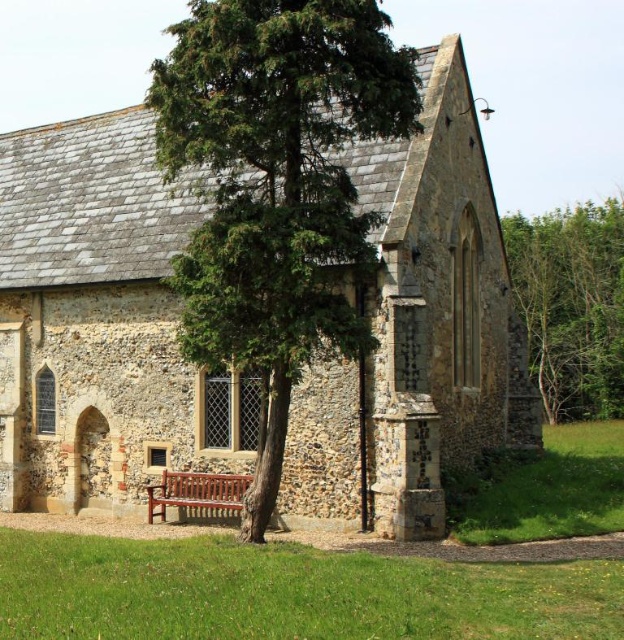
Question: Based on their relative distances, which object is nearer to the green leafy tree at right?

Choices:
 (A) green textured tree at center
 (B) polished wood bench at center

Answer: (A)

Question: From the image, what is the correct spatial relationship of green leafy tree at right in relation to polished wood bench at center?

Choices:
 (A) left
 (B) right

Answer: (B)

Question: Does green textured tree at center appear on the left side of green leafy tree at right?

Choices:
 (A) no
 (B) yes

Answer: (B)

Question: Estimate the real-world distances between objects in this image. Which object is farther from the polished wood bench at center?

Choices:
 (A) green leafy tree at right
 (B) green textured tree at center

Answer: (A)

Question: Is green textured tree at center bigger than green leafy tree at right?

Choices:
 (A) yes
 (B) no

Answer: (A)

Question: Which object is the farthest from the polished wood bench at center?

Choices:
 (A) green leafy tree at right
 (B) green textured tree at center

Answer: (A)